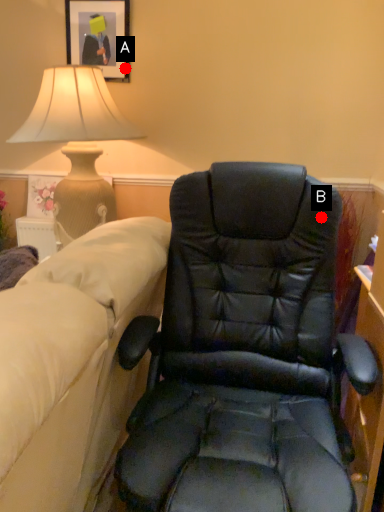
Question: Two points are circled on the image, labeled by A and B beside each circle. Which point is farther from the camera taking this photo?

Choices:
 (A) A is further
 (B) B is further

Answer: (A)